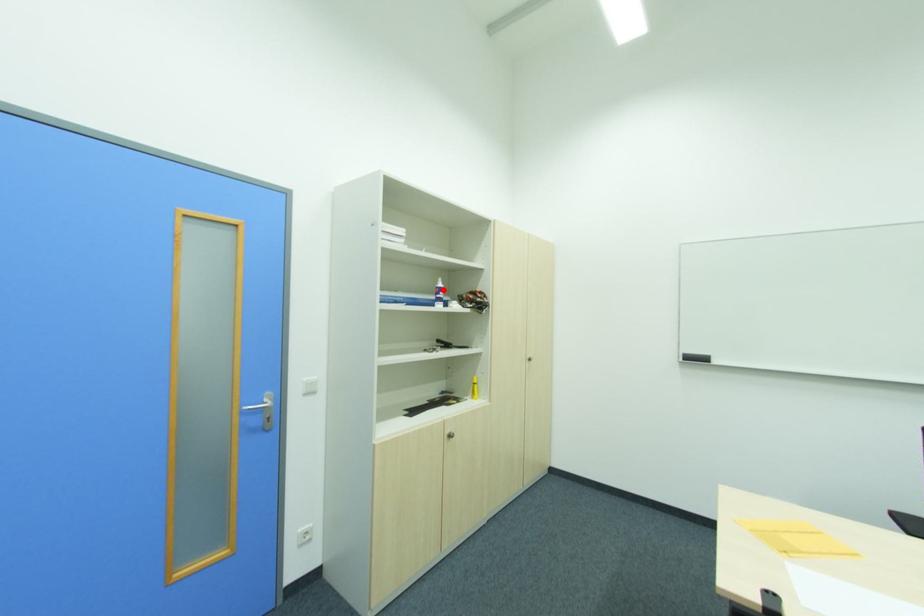
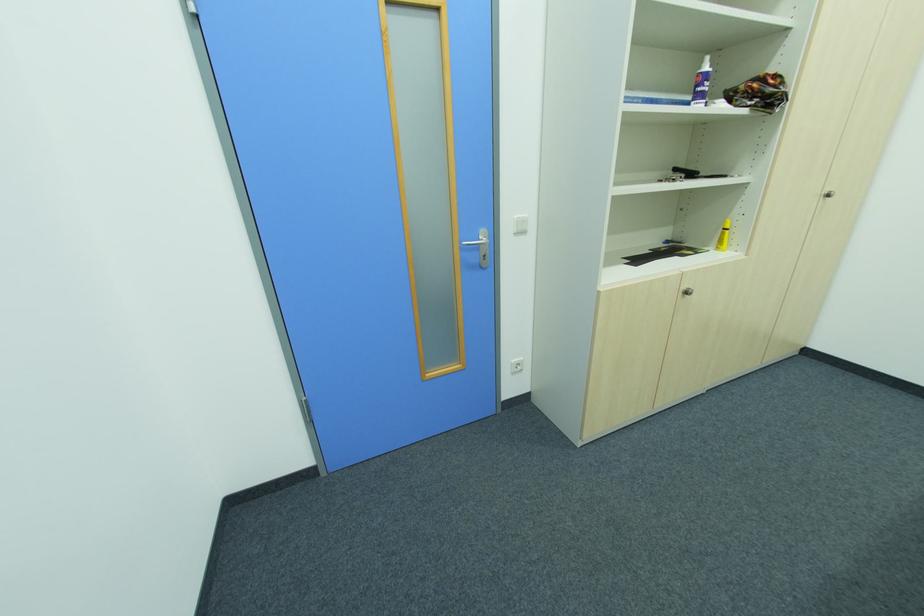
Question: I am providing you with two images of the same scene from different viewpoints. A red point is marked on the first image. Is the red point's position out of view in image 2?

Choices:
 (A) Yes
 (B) No

Answer: (B)